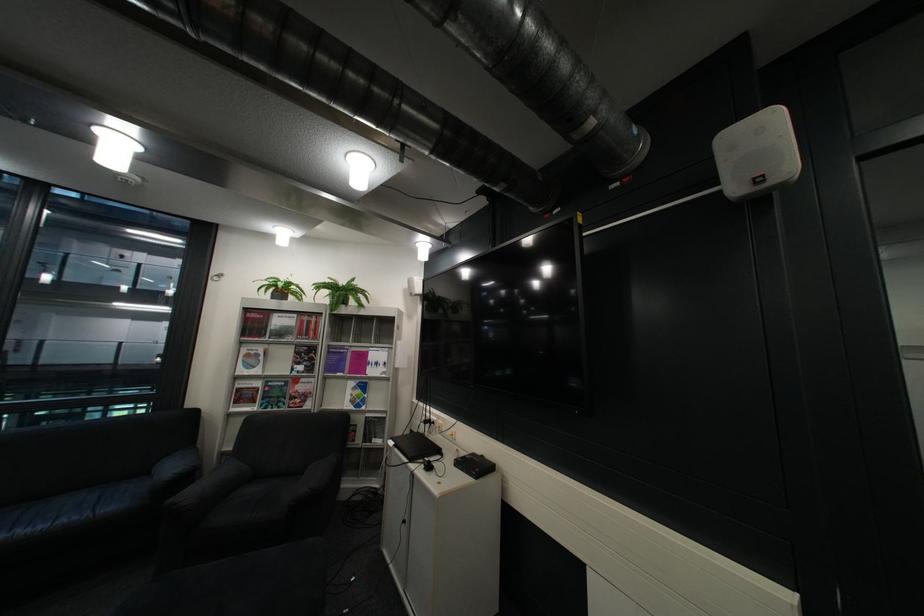
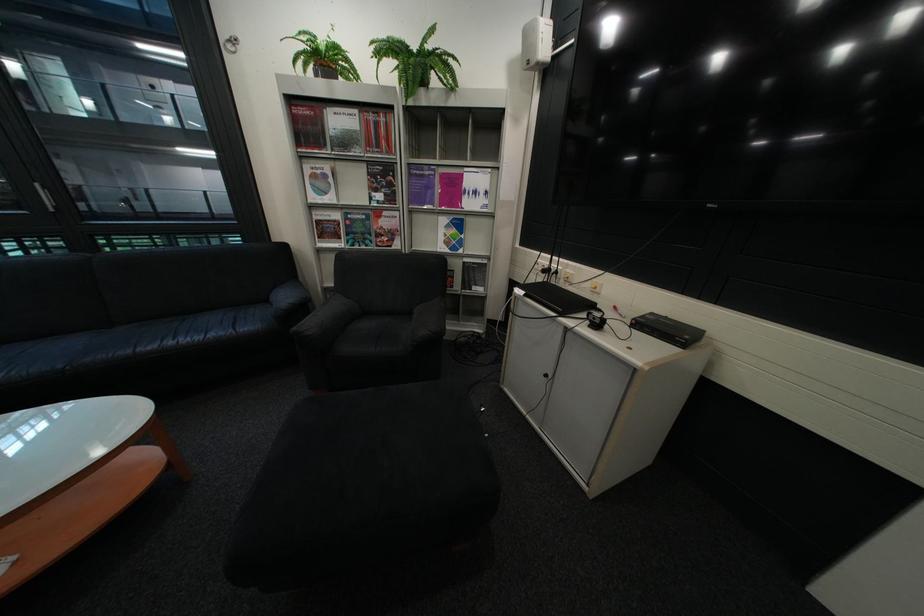
Locate, in the second image, the point that corresponds to pixel 329 365 in the first image.

(409, 192)